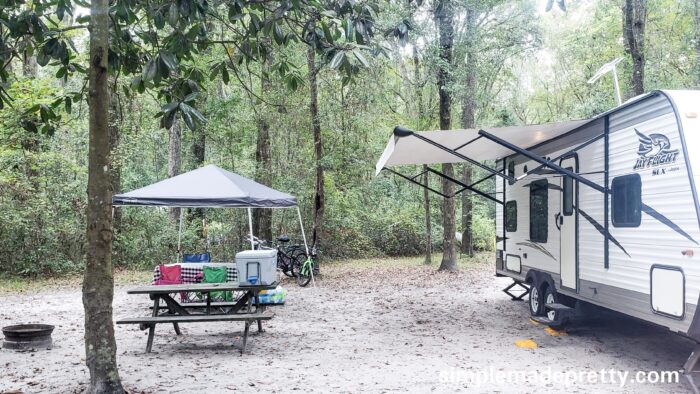
Locate an element on the screen. This screenshot has width=700, height=394. seats is located at coordinates (178, 314), (213, 297).